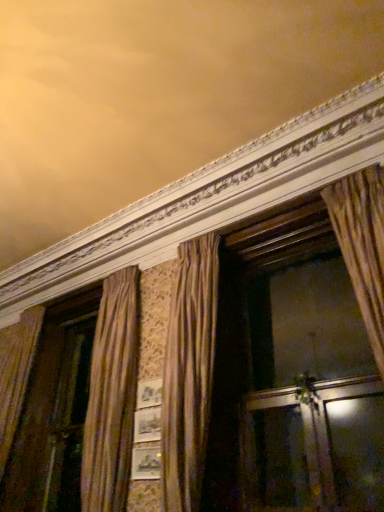
Question: Considering the positions of transparent glass screen door at lower right and gold textured curtain at center in the image, is transparent glass screen door at lower right bigger or smaller than gold textured curtain at center?

Choices:
 (A) small
 (B) big

Answer: (A)

Question: Considering the positions of transparent glass screen door at lower right and gold textured curtain at center in the image, is transparent glass screen door at lower right wider or thinner than gold textured curtain at center?

Choices:
 (A) wide
 (B) thin

Answer: (B)

Question: From the image's perspective, is transparent glass screen door at lower right positioned above or below gold textured curtain at center?

Choices:
 (A) above
 (B) below

Answer: (B)

Question: Is point (210, 352) positioned closer to the camera than point (377, 394)?

Choices:
 (A) closer
 (B) farther

Answer: (B)

Question: Visually, is gold textured curtain at center positioned to the left or to the right of transparent glass screen door at lower right?

Choices:
 (A) right
 (B) left

Answer: (B)

Question: Is gold textured curtain at center taller or shorter than transparent glass screen door at lower right?

Choices:
 (A) short
 (B) tall

Answer: (B)

Question: From a real-world perspective, is gold textured curtain at center above or below transparent glass screen door at lower right?

Choices:
 (A) above
 (B) below

Answer: (A)